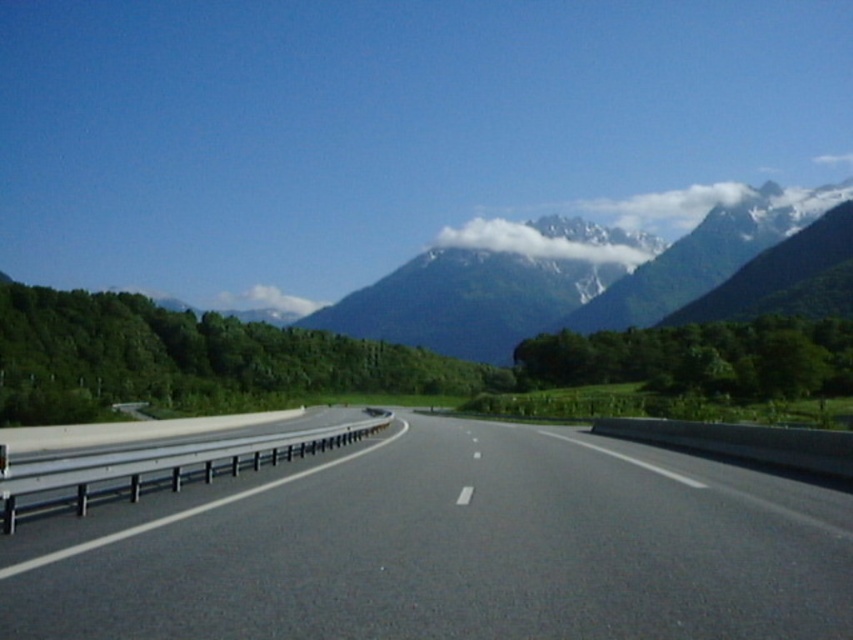
Question: Does white fluffy cloud at center appear over white fluffy cloud at upper center?

Choices:
 (A) yes
 (B) no

Answer: (A)

Question: Which point is farther to the camera?

Choices:
 (A) white fluffy cloud at center
 (B) black asphalt highway at center
 (C) white fluffy cloud at upper center

Answer: (C)

Question: Which object is positioned farthest from the black asphalt highway at center?

Choices:
 (A) white fluffy cloud at center
 (B) white fluffy cloud at upper center

Answer: (B)

Question: Which of the following is the farthest from the observer?

Choices:
 (A) black asphalt highway at center
 (B) white fluffy cloud at upper center
 (C) white fluffy cloud at center

Answer: (B)

Question: Can you confirm if black asphalt highway at center is positioned to the right of white fluffy cloud at center?

Choices:
 (A) no
 (B) yes

Answer: (A)

Question: Can you confirm if white fluffy cloud at center is positioned below white fluffy cloud at upper center?

Choices:
 (A) yes
 (B) no

Answer: (B)